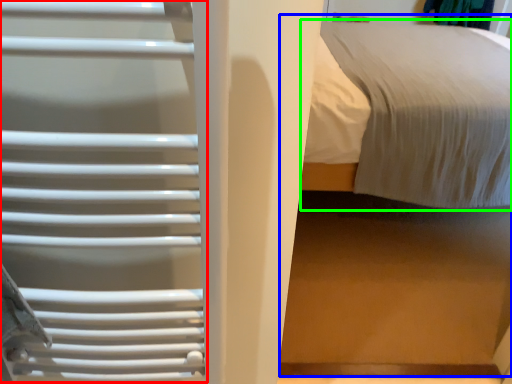
Question: Which is nearer to the cage (highlighted by a red box)? bed (highlighted by a blue box) or bed (highlighted by a green box).

Choices:
 (A) bed
 (B) bed

Answer: (A)